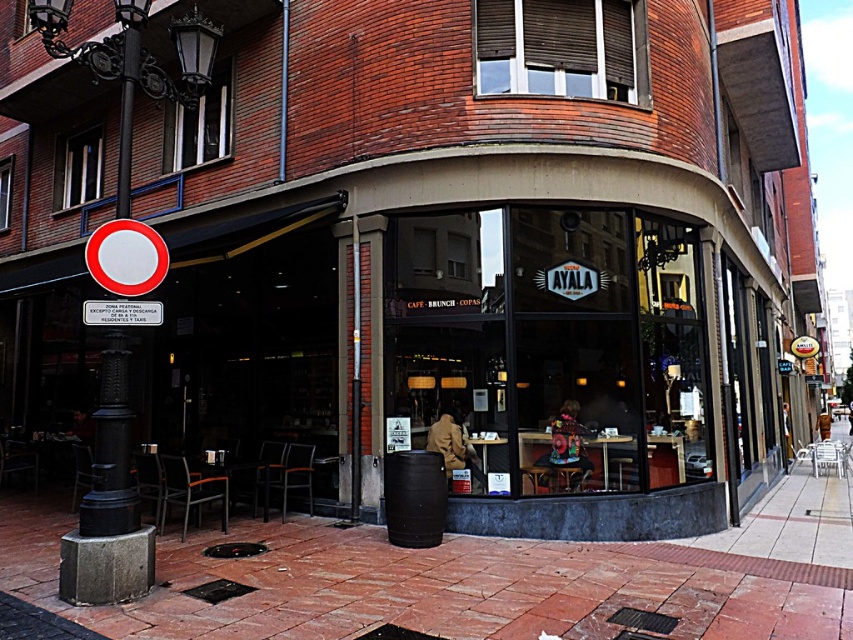
Which is behind, point (595, 621) or point (109, 36)?

The point (109, 36) is more distant.

Is brick pavement at lower center bigger than black cast iron pole at left?

Yes, brick pavement at lower center is bigger than black cast iron pole at left.

Does point (169, 538) come behind point (111, 332)?

Yes, point (169, 538) is behind point (111, 332).

Where is `brick pavement at lower center`? This screenshot has height=640, width=853. brick pavement at lower center is located at coordinates (477, 579).